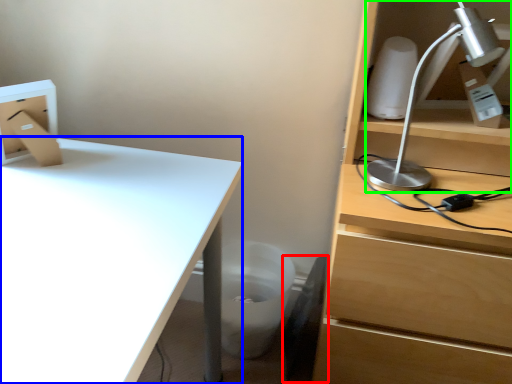
Question: Estimate the real-world distances between objects in this image. Which object is closer to swivel chair (highlighted by a red box), desk (highlighted by a blue box) or lamp (highlighted by a green box)?

Choices:
 (A) desk
 (B) lamp

Answer: (B)